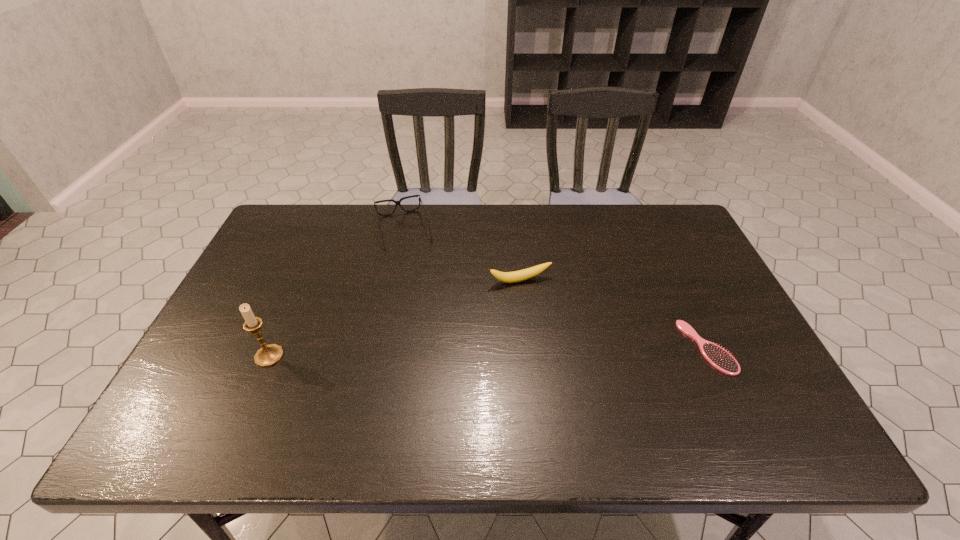
The height and width of the screenshot is (540, 960). I want to click on free spot that satisfies the following two spatial constraints: 1. on the back side of the tallest object; 2. on the right side of the rightmost object, so click(273, 347).

The width and height of the screenshot is (960, 540). Identify the location of free location that satisfies the following two spatial constraints: 1. on the back side of the rightmost object; 2. on the right side of the candle holder. (273, 347).